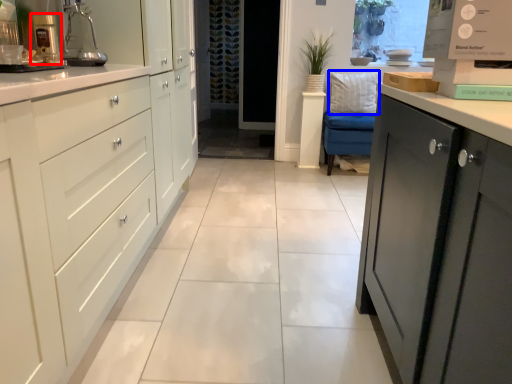
Question: Which object is further to the camera taking this photo, coffee machine (highlighted by a red box) or pillow (highlighted by a blue box)?

Choices:
 (A) coffee machine
 (B) pillow

Answer: (B)